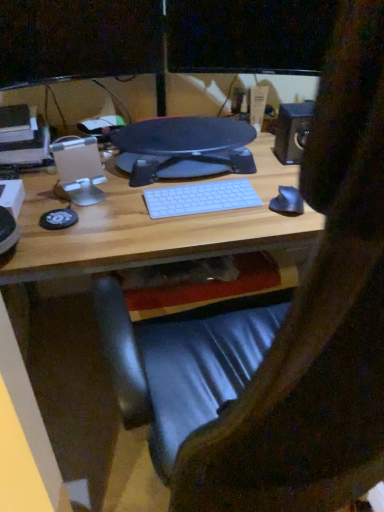
This screenshot has width=384, height=512. I want to click on free spot above glossy black monitor at center (from a real-world perspective), so click(178, 139).